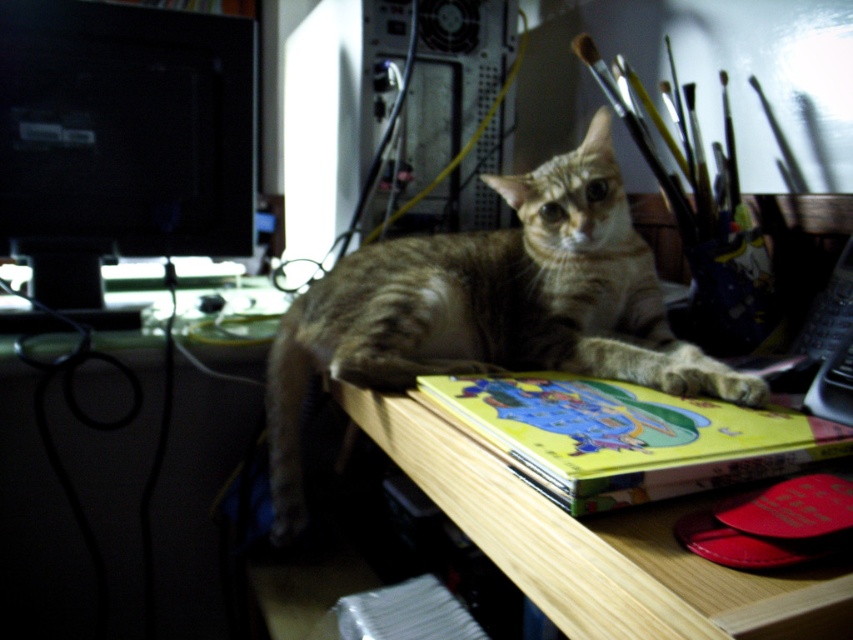
Question: Which point is farther from the camera taking this photo?

Choices:
 (A) 538,413
 (B) 125,387
 (C) 312,365
 (D) 239,134

Answer: (D)

Question: Considering the real-world distances, which object is closest to the matte plastic computer desk at lower left?

Choices:
 (A) black glossy monitor at left
 (B) tabby fur cat at center
 (C) yellow matte book at center

Answer: (A)

Question: Based on their relative distances, which object is nearer to the tabby fur cat at center?

Choices:
 (A) matte plastic computer desk at lower left
 (B) yellow matte book at center
 (C) black glossy monitor at left

Answer: (B)

Question: Is matte plastic computer desk at lower left to the left of yellow matte book at center from the viewer's perspective?

Choices:
 (A) yes
 (B) no

Answer: (A)

Question: Can you confirm if black glossy monitor at left is positioned below yellow matte book at center?

Choices:
 (A) no
 (B) yes

Answer: (A)

Question: Does tabby fur cat at center appear over yellow matte book at center?

Choices:
 (A) no
 (B) yes

Answer: (B)